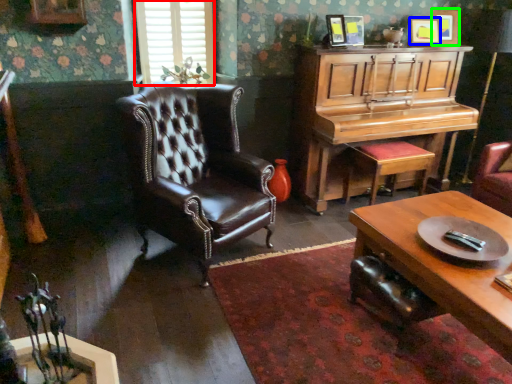
Question: Which object is positioned farthest from window (highlighted by a red box)? Select from picture frame (highlighted by a blue box) and picture frame (highlighted by a green box).

Choices:
 (A) picture frame
 (B) picture frame

Answer: (B)